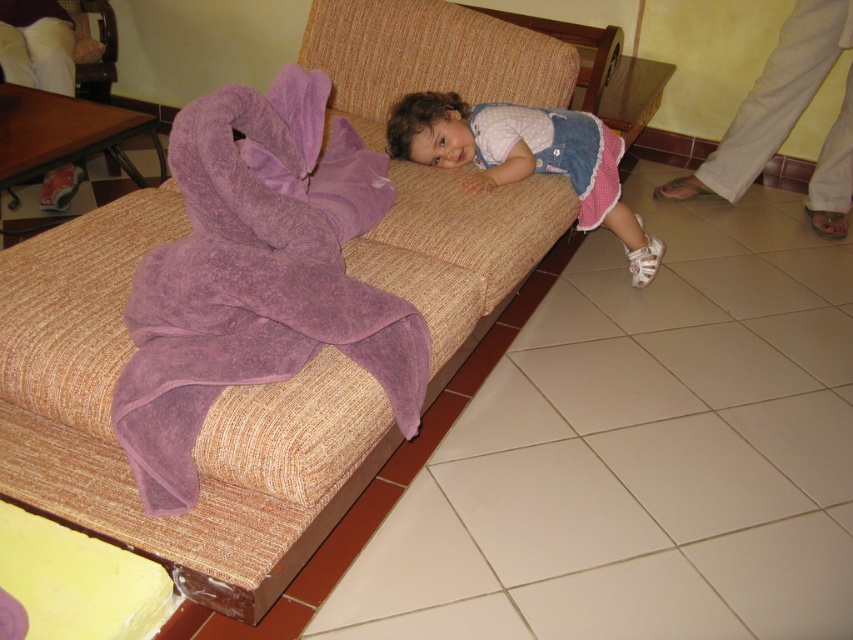
Question: Does purple terry cloth towel at left appear on the left side of matte pink dress at center?

Choices:
 (A) yes
 (B) no

Answer: (A)

Question: Which point is closer to the camera?

Choices:
 (A) beige textured couch at center
 (B) purple terry cloth towel at left

Answer: (A)

Question: Which object is the closest to the beige textured couch at center?

Choices:
 (A) purple terry cloth towel at left
 (B) purple terry cloth robe at upper right
 (C) purple terry cloth robe at upper left

Answer: (A)

Question: Can you confirm if matte pink dress at center is positioned below purple terry cloth robe at upper right?

Choices:
 (A) no
 (B) yes

Answer: (B)

Question: Does purple terry cloth towel at left have a larger size compared to purple terry cloth robe at upper left?

Choices:
 (A) yes
 (B) no

Answer: (A)

Question: Considering the real-world distances, which object is farthest from the matte pink dress at center?

Choices:
 (A) purple terry cloth robe at upper right
 (B) purple terry cloth robe at upper left

Answer: (B)